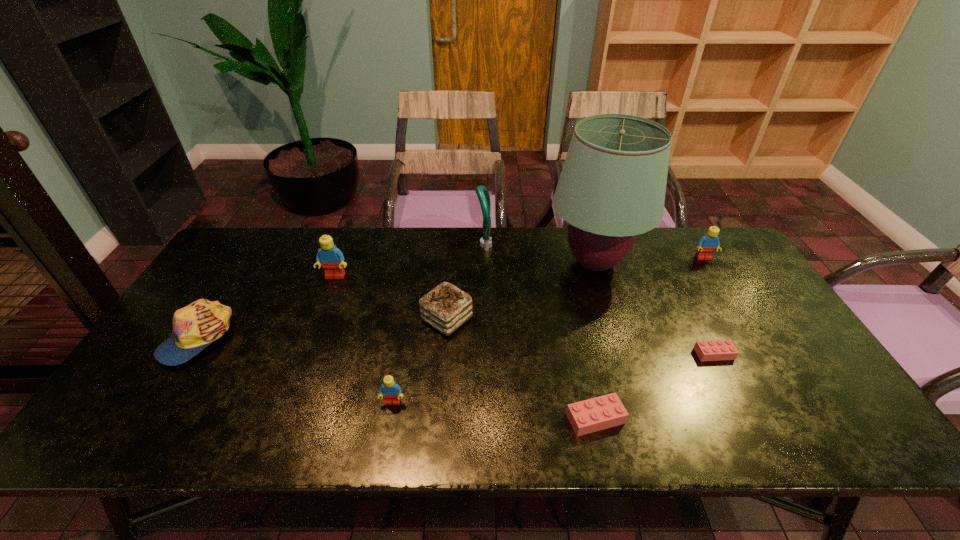
You are a GUI agent. You are given a task and a screenshot of the screen. Output one action in this format:
    pyautogui.click(x=<x>, y=<y>)
    Task: Click on the object that is at the right edge
    The image size is (960, 540).
    Given the screenshot: What is the action you would take?
    pyautogui.click(x=707, y=244)

Find the location of a particular element. This screenshot has width=960, height=540. object present at the far right corner is located at coordinates (707, 244).

Find the location of `vacant space at the far edge`. vacant space at the far edge is located at coordinates (554, 263).

The image size is (960, 540). Find the location of `vacant space at the near edge of the desktop`. vacant space at the near edge of the desktop is located at coordinates coord(557,436).

Where is `free location at the right edge`? Image resolution: width=960 pixels, height=540 pixels. free location at the right edge is located at coordinates (771, 336).

At what (x,y) coordinates should I click in order to perform the action: click on vacant space at the far right corner of the desktop. Please return your answer as a coordinate pair (x, y). Image resolution: width=960 pixels, height=540 pixels. Looking at the image, I should click on (691, 235).

Where is `vacant space that is in between the bottle opener and the sixth object from right to left`? Image resolution: width=960 pixels, height=540 pixels. vacant space that is in between the bottle opener and the sixth object from right to left is located at coordinates (466, 282).

I want to click on free point between the fourth Lego from right to left and the biggest blue Lego, so click(x=364, y=339).

I want to click on vacant space that's between the lampshade and the right pink Lego, so click(655, 308).

The height and width of the screenshot is (540, 960). Identify the location of empty location between the fourth shortest Lego and the third Lego from left to right. [x=649, y=338].